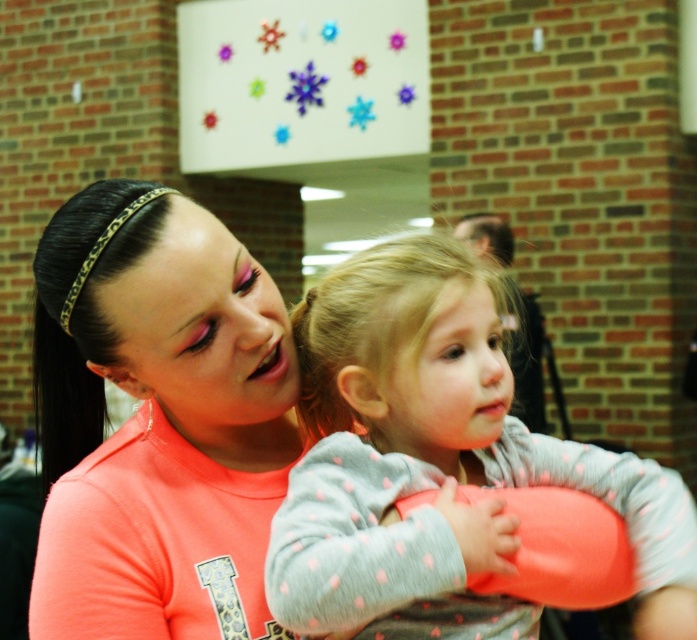
Question: Which point appears closest to the camera in this image?

Choices:
 (A) (x=367, y=316)
 (B) (x=245, y=324)

Answer: (A)

Question: Can you confirm if neon orange t-shirt at center is positioned to the left of gray dotted sweater at center?

Choices:
 (A) no
 (B) yes

Answer: (B)

Question: Among these points, which one is farthest from the camera?

Choices:
 (A) (691, 541)
 (B) (162, 316)

Answer: (A)

Question: Which object is farther from the camera taking this photo?

Choices:
 (A) neon orange t-shirt at center
 (B) gray dotted sweater at center

Answer: (A)

Question: Does neon orange t-shirt at center appear under gray dotted sweater at center?

Choices:
 (A) no
 (B) yes

Answer: (A)

Question: Considering the relative positions of neon orange t-shirt at center and gray dotted sweater at center in the image provided, where is neon orange t-shirt at center located with respect to gray dotted sweater at center?

Choices:
 (A) right
 (B) left

Answer: (B)